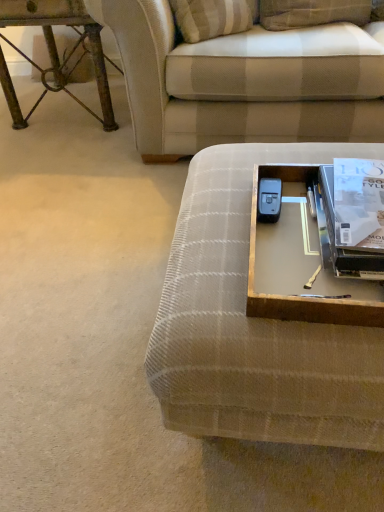
Question: Is rusty metal table at upper left inside the boundaries of metallic silver tray at lower right, or outside?

Choices:
 (A) inside
 (B) outside

Answer: (B)

Question: From a real-world perspective, is rusty metal table at upper left physically located above or below metallic silver tray at lower right?

Choices:
 (A) above
 (B) below

Answer: (B)

Question: Which is farther from the rusty metal table at upper left?

Choices:
 (A) plaid fabric couch at upper center, which ranks as the 1th studio couch in back-to-front order
 (B) plaid fabric studio couch at center, placed as the first studio couch when sorted from bottom to top
 (C) metallic silver tray at lower right

Answer: (C)

Question: Estimate the real-world distances between objects in this image. Which object is farther from the rusty metal table at upper left?

Choices:
 (A) metallic silver tray at lower right
 (B) plaid fabric studio couch at center, the second studio couch in the top-to-bottom sequence
 (C) plaid fabric couch at upper center, which ranks as the 1th studio couch in back-to-front order

Answer: (A)